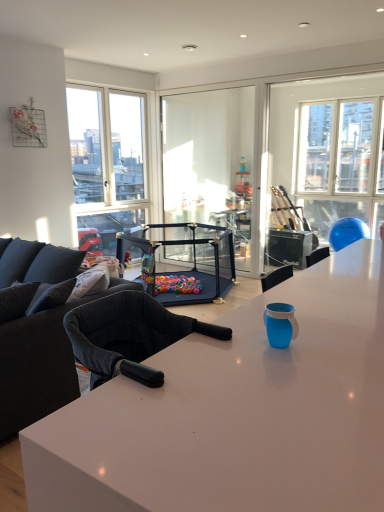
Identify the location of black plastic playpen at center. The width and height of the screenshot is (384, 512). (185, 259).

The height and width of the screenshot is (512, 384). I want to click on white glossy desk at center, so click(237, 413).

What are the coordinates of `black plastic playpen at center` in the screenshot? It's located at (185, 259).

Is black plastic playpen at center at the right side of black fabric couch at left?

Yes, black plastic playpen at center is to the right of black fabric couch at left.

In order to click on studio couch above the black plastic playpen at center (from a real-world perspective) in this screenshot , I will do `click(38, 331)`.

Considering the sizes of black plastic playpen at center and black fabric couch at left in the image, is black plastic playpen at center wider or thinner than black fabric couch at left?

Clearly, black plastic playpen at center has more width compared to black fabric couch at left.

How distant is black plastic playpen at center from black fabric couch at left?

6.17 feet.

Can you confirm if black fabric couch at left is bigger than white glossy desk at center?

Yes.

Is black fabric couch at left inside or outside of white glossy desk at center?

black fabric couch at left exists outside the volume of white glossy desk at center.

Consider the image. From the image's perspective, between black fabric couch at left and white glossy desk at center, which one is located above?

black fabric couch at left is shown above in the image.

From a real-world perspective, is black fabric couch at left beneath white glossy desk at center?

Yes.

Which is further, (176, 413) or (22, 397)?

The point (22, 397) is behind.

Between white glossy desk at center and black fabric couch at left, which one appears on the right side from the viewer's perspective?

white glossy desk at center.

In the image, there is a black fabric couch at left. In order to click on desk below it (from the image's perspective) in this screenshot , I will do `click(237, 413)`.

From a real-world perspective, who is located higher, black fabric couch at left or transparent glass window at upper right?

transparent glass window at upper right is physically above.

Considering the positions of point (35, 419) and point (298, 166), is point (35, 419) closer or farther from the camera than point (298, 166)?

Clearly, point (35, 419) is closer to the camera than point (298, 166).

Is black fabric couch at left positioned behind transparent glass window at upper right?

No.

Considering the relative sizes of black fabric couch at left and transparent glass window at upper right in the image provided, is black fabric couch at left thinner than transparent glass window at upper right?

In fact, black fabric couch at left might be wider than transparent glass window at upper right.

Between black plastic playpen at center and white glossy desk at center, which one has smaller size?

Smaller between the two is black plastic playpen at center.

From the image's perspective, is black plastic playpen at center on white glossy desk at center?

Yes, from the image's perspective, black plastic playpen at center is above white glossy desk at center.

Where is `equipment that appears above the white glossy desk at center (from the image's perspective)`? equipment that appears above the white glossy desk at center (from the image's perspective) is located at coordinates (185, 259).

How different are the orientations of black plastic playpen at center and transparent glass window at upper right in degrees?

90.4 degrees separate the facing orientations of black plastic playpen at center and transparent glass window at upper right.

From a real-world perspective, between black plastic playpen at center and transparent glass window at upper right, who is vertically lower?

In real-world perspective, black plastic playpen at center is lower.

Which is behind, black plastic playpen at center or transparent glass window at upper right?

Positioned behind is transparent glass window at upper right.

Is black plastic playpen at center smaller than transparent glass window at upper right?

No.

Is white glossy desk at center facing towards transparent glass window at upper right?

No, white glossy desk at center is not facing towards transparent glass window at upper right.

Between white glossy desk at center and transparent glass window at upper right, which one is positioned in front?

Positioned in front is white glossy desk at center.

Considering the relative sizes of white glossy desk at center and transparent glass window at upper right in the image provided, is white glossy desk at center thinner than transparent glass window at upper right?

Incorrect, the width of white glossy desk at center is not less than that of transparent glass window at upper right.

How many degrees apart are the facing directions of white glossy desk at center and transparent glass window at upper right?

90.6 degrees separate the facing orientations of white glossy desk at center and transparent glass window at upper right.

What are the coordinates of `equipment above the black fabric couch at left (from the image's perspective)` in the screenshot? It's located at (185, 259).

Find the location of a particular element. The image size is (384, 512). desk above the black fabric couch at left (from a real-world perspective) is located at coordinates (237, 413).

Based on their spatial positions, is white glossy desk at center or transparent glass window at upper right further from black plastic playpen at center?

white glossy desk at center.

When comparing their distances from white glossy desk at center, does black fabric couch at left or black plastic playpen at center seem closer?

black fabric couch at left is positioned closer to the anchor white glossy desk at center.

Considering their positions, is black fabric couch at left positioned further to transparent glass window at upper right than black plastic playpen at center?

black fabric couch at left lies further to transparent glass window at upper right than the other object.

Looking at the image, which one is located closer to white glossy desk at center, black fabric couch at left or transparent glass window at upper right?

Result: black fabric couch at left lies closer to white glossy desk at center than the other object.

Considering their positions, is black fabric couch at left positioned further to transparent glass window at upper right than white glossy desk at center?

white glossy desk at center is positioned further to the anchor transparent glass window at upper right.

When comparing their distances from transparent glass window at upper right, does white glossy desk at center or black plastic playpen at center seem further?

Among the two, white glossy desk at center is located further to transparent glass window at upper right.

Based on their spatial positions, is black plastic playpen at center or transparent glass window at upper right closer to black fabric couch at left?

black plastic playpen at center lies closer to black fabric couch at left than the other object.

From the image, which object appears to be farther from transparent glass window at upper right, white glossy desk at center or black fabric couch at left?

Among the two, white glossy desk at center is located further to transparent glass window at upper right.

In order to click on studio couch between white glossy desk at center and black plastic playpen at center along the z-axis in this screenshot , I will do `click(38, 331)`.

At what (x,y) coordinates should I click in order to perform the action: click on equipment between black fabric couch at left and transparent glass window at upper right. Please return your answer as a coordinate pair (x, y). The height and width of the screenshot is (512, 384). Looking at the image, I should click on (185, 259).

Where is `equipment between white glossy desk at center and transparent glass window at upper right along the z-axis`? The height and width of the screenshot is (512, 384). equipment between white glossy desk at center and transparent glass window at upper right along the z-axis is located at coordinates (185, 259).

I want to click on studio couch located between white glossy desk at center and transparent glass window at upper right in the depth direction, so click(x=38, y=331).